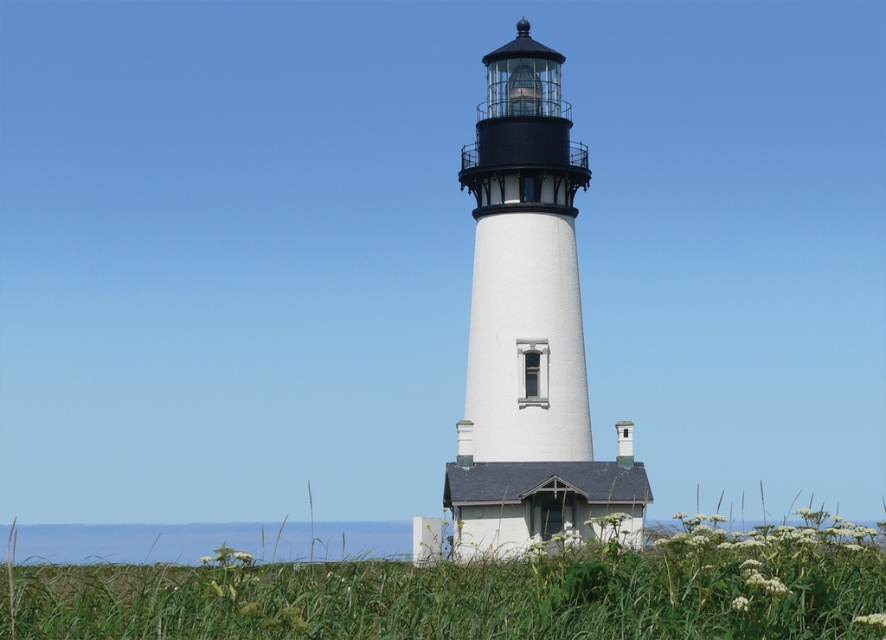
Question: Is green grass at center above white painted concrete lighthouse at center?

Choices:
 (A) yes
 (B) no

Answer: (B)

Question: Can you confirm if green grass at center is bigger than white painted concrete lighthouse at center?

Choices:
 (A) yes
 (B) no

Answer: (A)

Question: Among these points, which one is nearest to the camera?

Choices:
 (A) pos(531,304)
 (B) pos(117,593)

Answer: (B)

Question: Which point appears farthest from the camera in this image?

Choices:
 (A) (571, 356)
 (B) (752, 536)

Answer: (A)

Question: Can you confirm if green grass at center is positioned to the left of white painted concrete lighthouse at center?

Choices:
 (A) yes
 (B) no

Answer: (A)